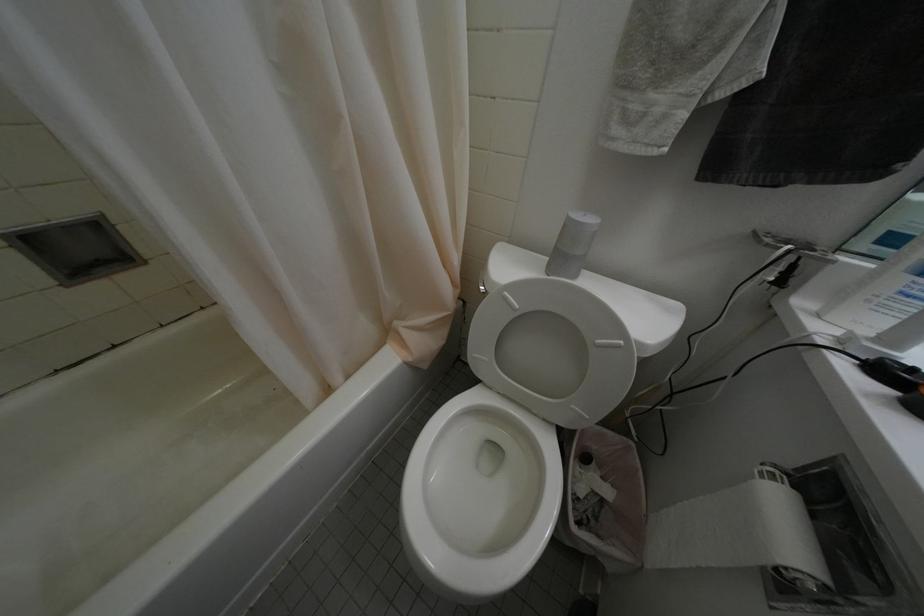
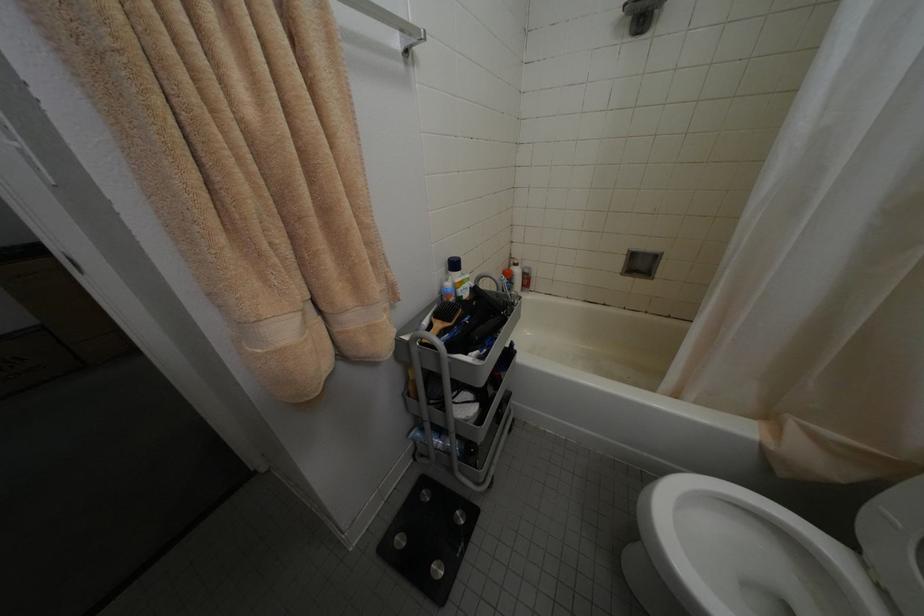
The first image is from the beginning of the video and the second image is from the end. How did the camera likely rotate when shooting the video?

The camera's rotation is toward left-down.